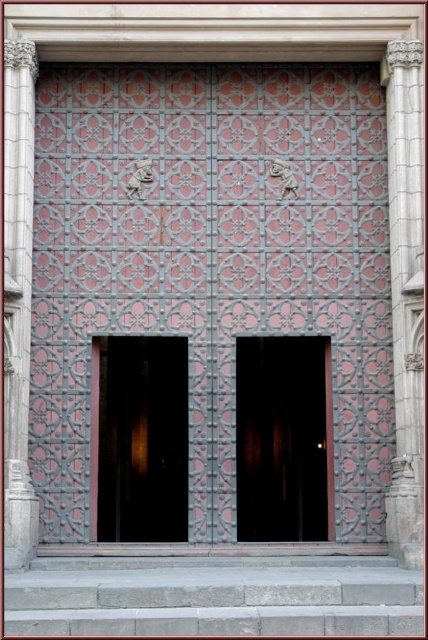
You are an architect inspecting the building facade. You notice the dark wood door at center and the carved stone column at right. Which object is taller?

The carved stone column at right is taller than the dark wood door at center.